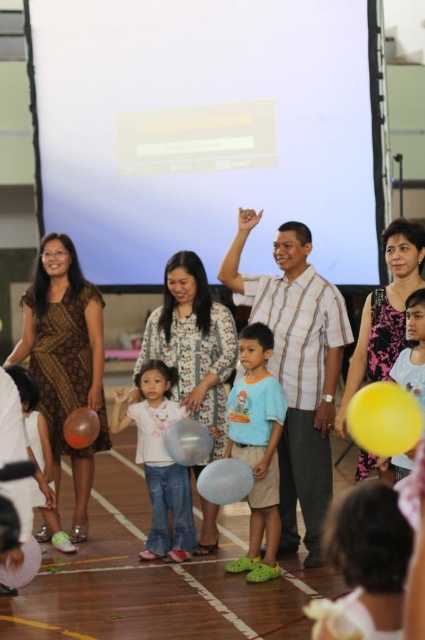
Does point (183, 554) come behind point (396, 454)?

Yes, it is behind point (396, 454).

The width and height of the screenshot is (425, 640). I want to click on white matte shirt at center, so click(158, 461).

Where is `white matte shirt at center`? white matte shirt at center is located at coordinates (158, 461).

This screenshot has height=640, width=425. I want to click on white matte shirt at center, so click(158, 461).

What do you see at coordinates (158, 461) in the screenshot?
I see `white matte shirt at center` at bounding box center [158, 461].

Between white matte shirt at center and translucent plastic balloon at center, which one has less height?

With less height is translucent plastic balloon at center.

Which is in front, point (158, 438) or point (189, 419)?

Point (189, 419) is in front.

Locate an element on the screen. Image resolution: width=425 pixels, height=640 pixels. white matte shirt at center is located at coordinates (158, 461).

Does light blue cotton shirt at center have a greater width compared to translucent plastic balloon at center?

Yes.

Between light blue cotton shirt at center and translucent plastic balloon at center, which one appears on the left side from the viewer's perspective?

Positioned to the left is translucent plastic balloon at center.

The image size is (425, 640). What are the coordinates of `light blue cotton shirt at center` in the screenshot? It's located at (257, 448).